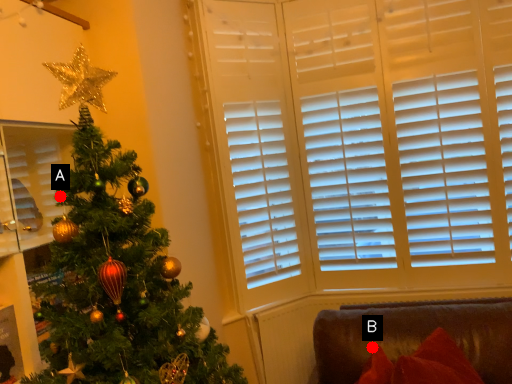
Question: Two points are circled on the image, labeled by A and B beside each circle. Which point appears closest to the camera in this image?

Choices:
 (A) A is closer
 (B) B is closer

Answer: (A)